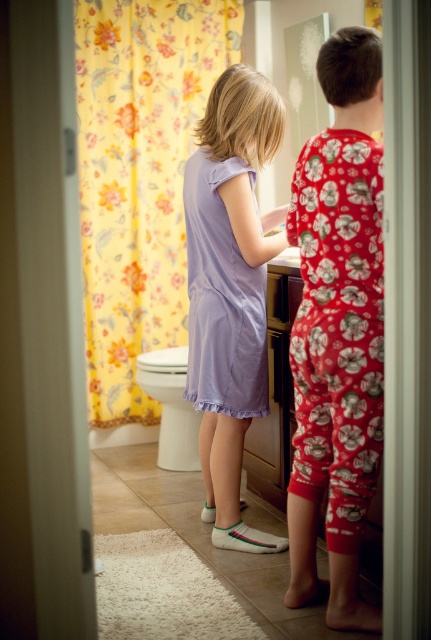
Question: Does yellow floral fabric at left have a larger size compared to matte purple dress at center?

Choices:
 (A) yes
 (B) no

Answer: (A)

Question: Can you confirm if matte purple dress at center is thinner than white glossy toilet bowl at lower left?

Choices:
 (A) yes
 (B) no

Answer: (A)

Question: Which object is the closest to the yellow floral fabric at left?

Choices:
 (A) lavender cotton dress at center
 (B) matte purple dress at center
 (C) lavender satin dress at center
 (D) white glossy toilet bowl at lower left

Answer: (D)

Question: Which point is closer to the camera?

Choices:
 (A) (175, 348)
 (B) (377, 436)
 (C) (191, 284)
 (D) (178, 154)

Answer: (B)

Question: Which point is closer to the camera?

Choices:
 (A) (186, 269)
 (B) (206, 301)

Answer: (B)

Question: Is lavender cotton dress at center bigger than white glossy toilet bowl at lower left?

Choices:
 (A) no
 (B) yes

Answer: (B)